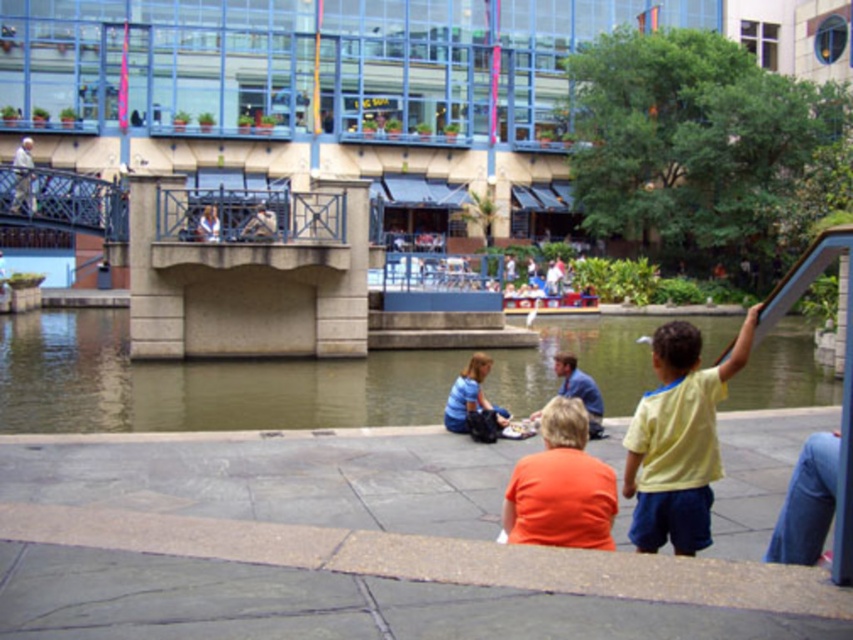
Question: Based on their relative distances, which object is farther from the blue denim shirt at center?

Choices:
 (A) yellow matte shirt at lower right
 (B) light blue shirt at upper center
 (C) greenish water at center

Answer: (B)

Question: Estimate the real-world distances between objects in this image. Which object is closer to the greenish water at center?

Choices:
 (A) blue denim shirt at center
 (B) light gray concrete bridge at upper left
 (C) yellow matte shirt at lower right

Answer: (A)

Question: Which of the following is the closest to the observer?

Choices:
 (A) (309, 387)
 (B) (561, 371)
 (C) (32, 212)
 (D) (213, 221)

Answer: (B)

Question: Is blue denim shirt at center thinner than light blue shirt at upper center?

Choices:
 (A) no
 (B) yes

Answer: (A)

Question: Does greenish water at center have a lesser width compared to light gray concrete bridge at upper left?

Choices:
 (A) yes
 (B) no

Answer: (B)

Question: Is greenish water at center behind light blue shirt at upper center?

Choices:
 (A) yes
 (B) no

Answer: (B)